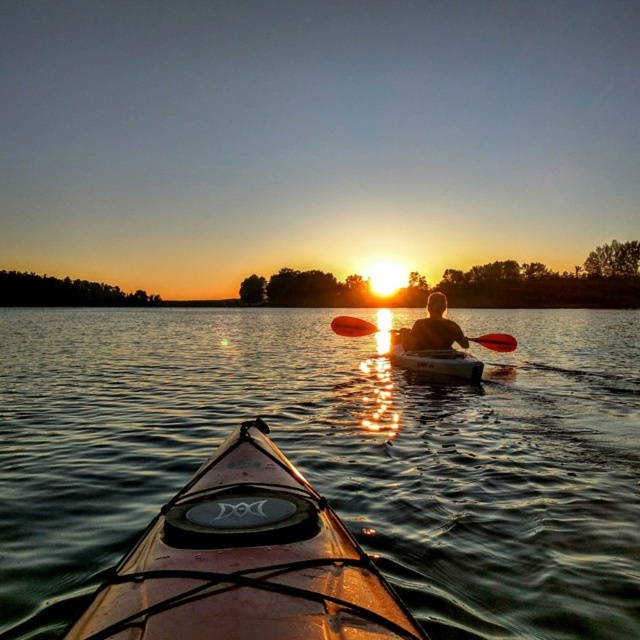
Does point (262, 380) come closer to viewer compared to point (442, 307)?

No.

Does translucent water at center have a larger size compared to matte black kayak at center?

Yes.

Who is more distant from viewer, (419, 611) or (438, 296)?

Point (438, 296)

Find the location of a particular element. The height and width of the screenshot is (640, 640). translucent water at center is located at coordinates (333, 456).

Is brown matte canoe at center shorter than white plastic canoe at center?

Indeed, brown matte canoe at center has a lesser height compared to white plastic canoe at center.

The image size is (640, 640). Describe the element at coordinates (244, 563) in the screenshot. I see `brown matte canoe at center` at that location.

Between point (232, 438) and point (467, 376), which one is positioned behind?

The point (467, 376) is more distant.

Identify the location of brown matte canoe at center. (244, 563).

Does white plastic canoe at center appear under matte orange paddle at center?

Indeed, white plastic canoe at center is positioned under matte orange paddle at center.

Where is `white plastic canoe at center`? white plastic canoe at center is located at coordinates (435, 362).

This screenshot has height=640, width=640. I want to click on white plastic canoe at center, so click(435, 362).